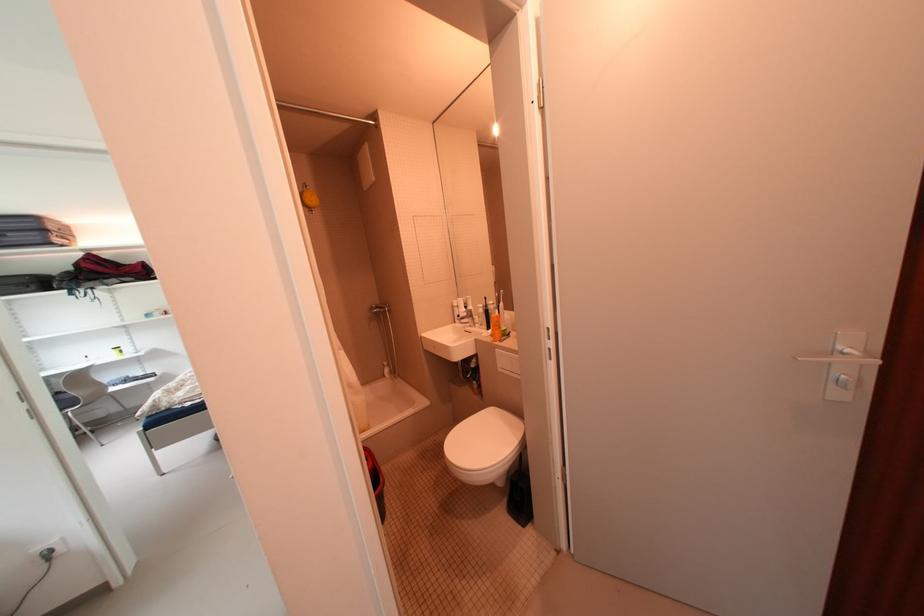
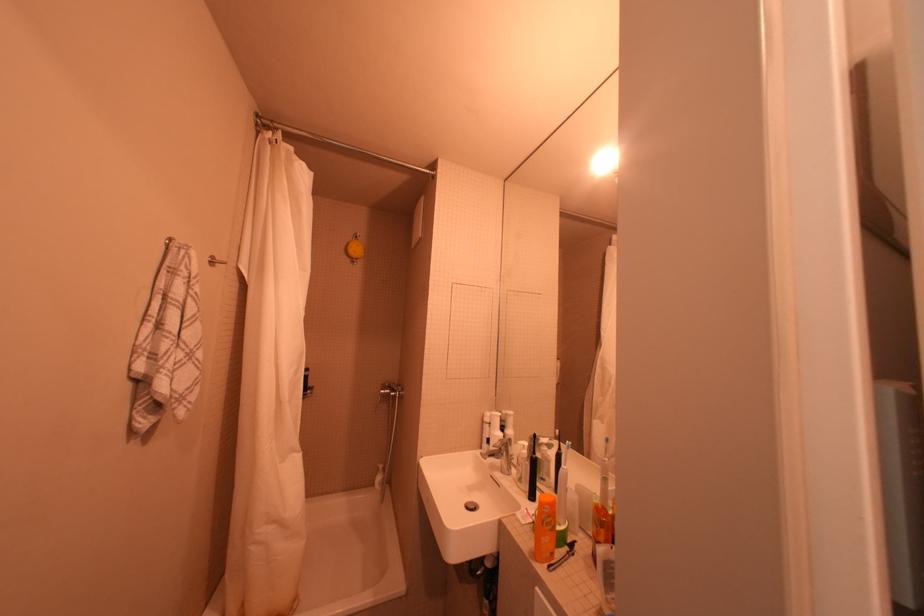
The point at (505, 345) is marked in the first image. Where is the corresponding point in the second image?

(551, 570)